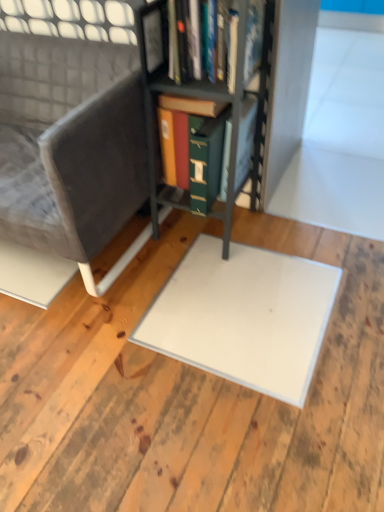
In order to click on white matte plywood at center in this screenshot , I will do (x=190, y=396).

What is the approximate width of white matte plywood at center?

The width of white matte plywood at center is 1.71 meters.

Locate an element on the screen. This screenshot has width=384, height=512. metallic gray bookcase at center is located at coordinates (211, 101).

Considering the positions of point (241, 22) and point (170, 413), is point (241, 22) closer or farther from the camera than point (170, 413)?

Point (241, 22) is closer to the camera than point (170, 413).

Locate an element on the screen. This screenshot has width=384, height=512. bookcase behind the white matte plywood at center is located at coordinates (211, 101).

Is metallic gray bookcase at center completely or partially outside of white matte plywood at center?

Yes, metallic gray bookcase at center is outside of white matte plywood at center.

From the image's perspective, does metallic gray bookcase at center appear higher than white matte plywood at center?

Yes, from the image's perspective, metallic gray bookcase at center is over white matte plywood at center.

Which of these two, velvet grey chair at left or white matte plywood at center, is smaller?

white matte plywood at center.

Where is `chair on the left of white matte plywood at center`? Image resolution: width=384 pixels, height=512 pixels. chair on the left of white matte plywood at center is located at coordinates (67, 161).

Is the position of velvet grey chair at left less distant than that of white matte plywood at center?

No, velvet grey chair at left is behind white matte plywood at center.

Can you tell me how much velvet grey chair at left and white matte plywood at center differ in facing direction?

The angular difference between velvet grey chair at left and white matte plywood at center is 90.5 degrees.

Looking at this image, does white matte plywood at center turn towards metallic gray bookcase at center?

No, white matte plywood at center is not facing towards metallic gray bookcase at center.

Are white matte plywood at center and metallic gray bookcase at center making contact?

No, white matte plywood at center is not touching metallic gray bookcase at center.

Between point (154, 469) and point (195, 198), which one is positioned in front?

The point (154, 469) is in front.

How far apart are white matte plywood at center and metallic gray bookcase at center?

white matte plywood at center and metallic gray bookcase at center are 26.76 inches apart from each other.

Is white matte plywood at center facing away from velvet grey chair at left?

Yes, velvet grey chair at left is at the back of white matte plywood at center.

Is white matte plywood at center bigger than velvet grey chair at left?

No, white matte plywood at center is not bigger than velvet grey chair at left.

From a real-world perspective, relative to velvet grey chair at left, is white matte plywood at center vertically above or below?

In terms of real-world spatial position, white matte plywood at center is below velvet grey chair at left.

How many degrees apart are the facing directions of metallic gray bookcase at center and velvet grey chair at left?

0.0924 degrees.

Looking at this image, is metallic gray bookcase at center to the left of velvet grey chair at left from the viewer's perspective?

In fact, metallic gray bookcase at center is to the right of velvet grey chair at left.

Which is behind, point (246, 103) or point (29, 129)?

The point (29, 129) is farther.

From the image's perspective, is metallic gray bookcase at center below velvet grey chair at left?

No, from the image's perspective, metallic gray bookcase at center is not beneath velvet grey chair at left.

Does velvet grey chair at left come behind metallic gray bookcase at center?

Yes.

This screenshot has width=384, height=512. Identify the location of chair below the metallic gray bookcase at center (from a real-world perspective). (67, 161).

From a real-world perspective, relative to metallic gray bookcase at center, is velvet grey chair at left vertically above or below?

Clearly, from a real-world perspective, velvet grey chair at left is below metallic gray bookcase at center.

From the image's perspective, is velvet grey chair at left below metallic gray bookcase at center?

Indeed, from the image's perspective, velvet grey chair at left is shown beneath metallic gray bookcase at center.

Where is `bookcase positioned vertically above the white matte plywood at center (from a real-world perspective)`? The height and width of the screenshot is (512, 384). bookcase positioned vertically above the white matte plywood at center (from a real-world perspective) is located at coordinates (211, 101).

Where is `plywood that appears on the right of velvet grey chair at left`? The image size is (384, 512). plywood that appears on the right of velvet grey chair at left is located at coordinates (190, 396).

Based on their spatial positions, is velvet grey chair at left or white matte plywood at center closer to metallic gray bookcase at center?

Among the two, velvet grey chair at left is located nearer to metallic gray bookcase at center.

From the image, which object appears to be farther from white matte plywood at center, velvet grey chair at left or metallic gray bookcase at center?

Among the two, metallic gray bookcase at center is located further to white matte plywood at center.

Based on their spatial positions, is white matte plywood at center or velvet grey chair at left further from metallic gray bookcase at center?

white matte plywood at center lies further to metallic gray bookcase at center than the other object.

Estimate the real-world distances between objects in this image. Which object is closer to velvet grey chair at left, metallic gray bookcase at center or white matte plywood at center?

Among the two, metallic gray bookcase at center is located nearer to velvet grey chair at left.

Estimate the real-world distances between objects in this image. Which object is closer to velvet grey chair at left, white matte plywood at center or metallic gray bookcase at center?

metallic gray bookcase at center is positioned closer to the anchor velvet grey chair at left.

Considering their positions, is metallic gray bookcase at center positioned closer to white matte plywood at center than velvet grey chair at left?

Among the two, velvet grey chair at left is located nearer to white matte plywood at center.

At what (x,y) coordinates should I click in order to perform the action: click on plywood located between velvet grey chair at left and metallic gray bookcase at center in the left-right direction. Please return your answer as a coordinate pair (x, y). Looking at the image, I should click on (190, 396).